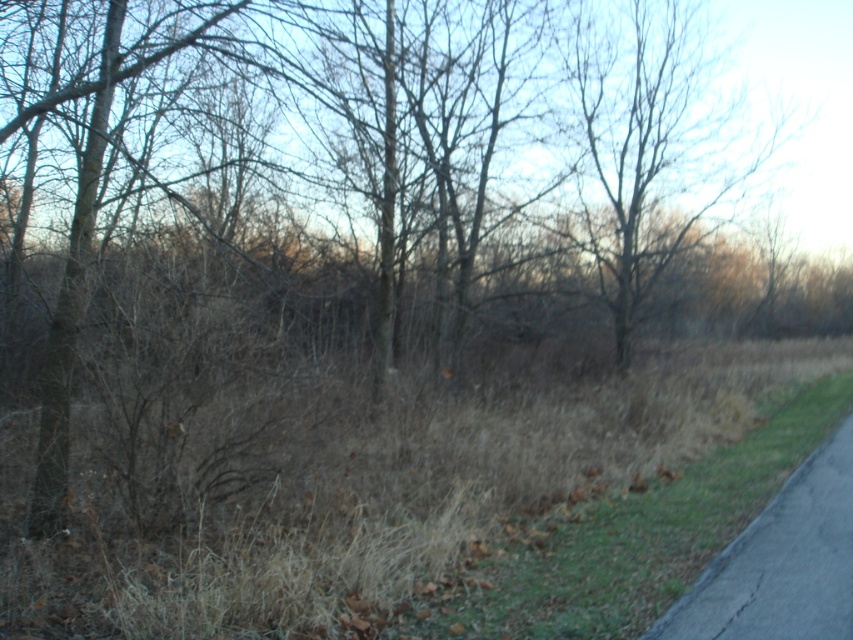
Question: Among these points, which one is nearest to the camera?

Choices:
 (A) (665, 408)
 (B) (490, 602)

Answer: (B)

Question: Does brown dry grass at lower right appear over black asphalt bike path at lower right?

Choices:
 (A) yes
 (B) no

Answer: (B)

Question: Can you confirm if brown dry grass at lower left is bigger than black asphalt bike path at lower right?

Choices:
 (A) yes
 (B) no

Answer: (A)

Question: Which of these objects is positioned farthest from the black asphalt bike path at lower right?

Choices:
 (A) brown dry grass at lower right
 (B) brown dry grass at lower left

Answer: (B)

Question: Estimate the real-world distances between objects in this image. Which object is farther from the brown dry grass at lower left?

Choices:
 (A) brown dry grass at lower right
 (B) black asphalt bike path at lower right

Answer: (B)

Question: Does brown dry grass at lower left appear over black asphalt bike path at lower right?

Choices:
 (A) yes
 (B) no

Answer: (A)